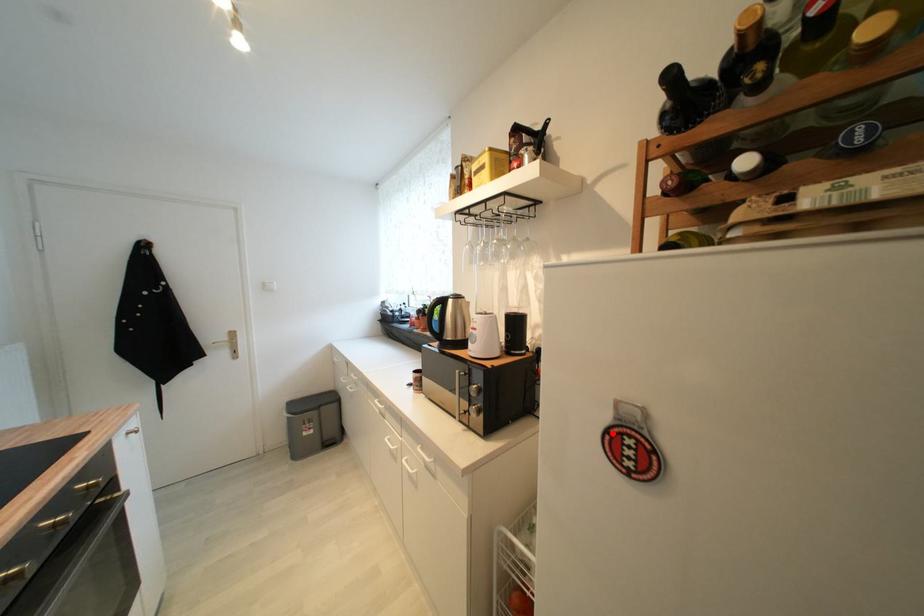
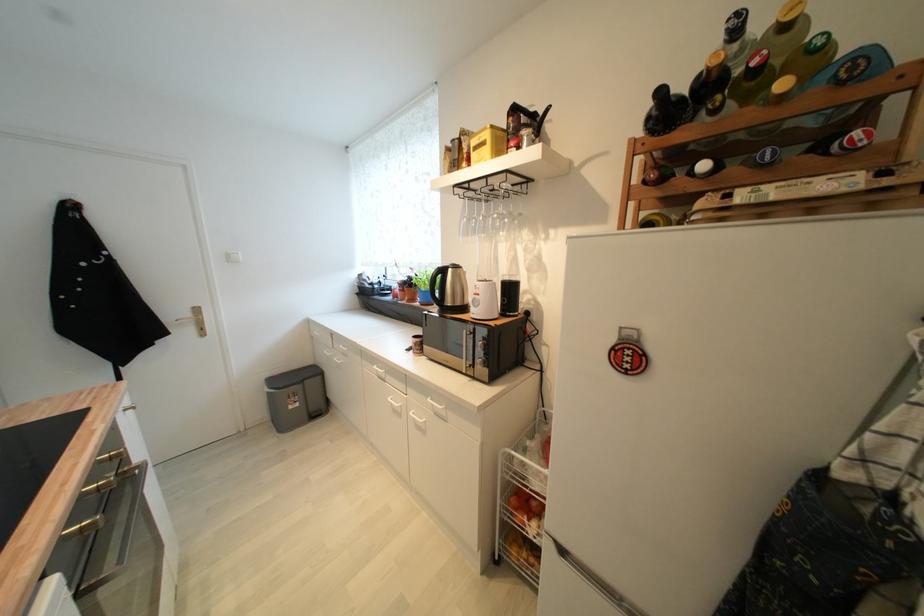
Question: I am providing you with two images of the same scene from different viewpoints. Image1 has a red point marked. In image2, the corresponding 3D location appears at what relative position? Reply with the corresponding letter.

Choices:
 (A) Closer
 (B) Farther

Answer: (A)